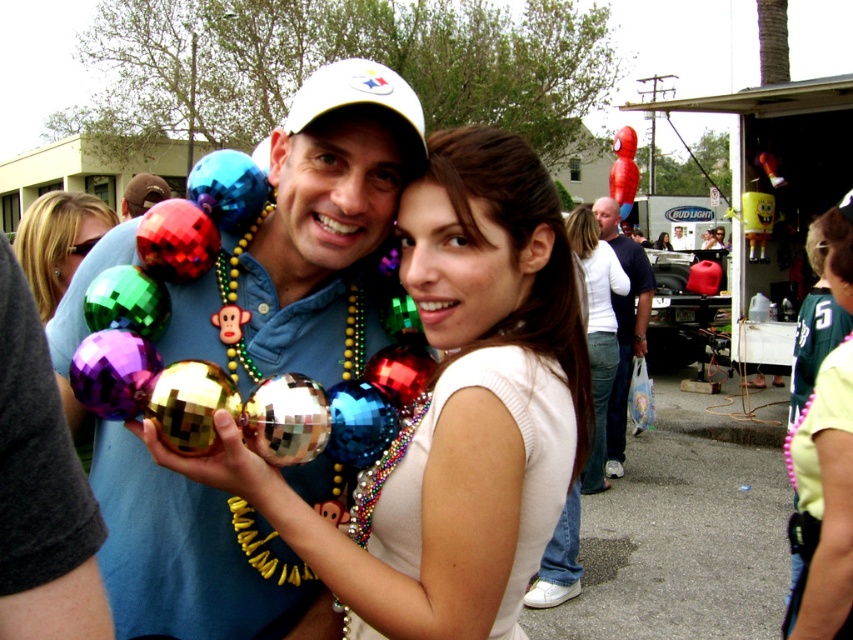
Does white cotton t-shirt at center have a larger size compared to matte white shirt at center?

Yes.

Who is more forward, [628,387] or [660,236]?

Positioned in front is point [628,387].

Measure the distance between white cotton t-shirt at center and camera.

white cotton t-shirt at center and camera are 22.18 feet apart.

Locate an element on the screen. Image resolution: width=853 pixels, height=640 pixels. white cotton t-shirt at center is located at coordinates (624, 324).

Which is more to the left, shiny metallic ornaments at center or white matte shirt at center?

shiny metallic ornaments at center

Who is more forward, [460,516] or [583,273]?

Positioned in front is point [460,516].

Who is more distant from viewer, [396,506] or [610,330]?

The point [610,330] is behind.

Image resolution: width=853 pixels, height=640 pixels. Find the location of `shiny metallic ornaments at center`. shiny metallic ornaments at center is located at coordinates (450, 404).

Is shiny metallic ball at center above matte white shirt at center?

Correct, shiny metallic ball at center is located above matte white shirt at center.

Can you confirm if shiny metallic ball at center is shorter than matte white shirt at center?

No.

Where is `shiny metallic ball at center`? Image resolution: width=853 pixels, height=640 pixels. shiny metallic ball at center is located at coordinates (142, 193).